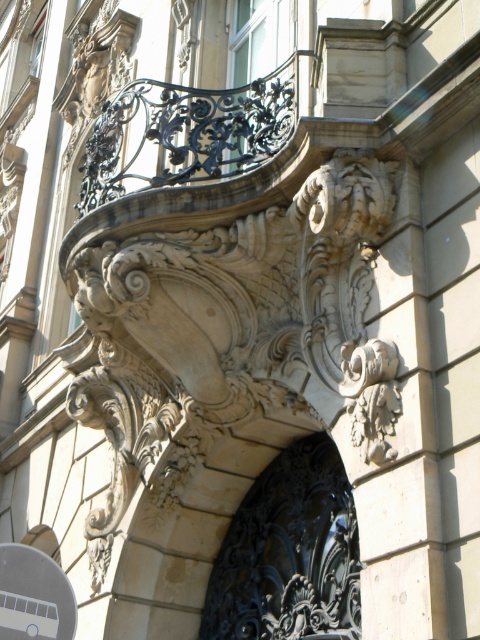
Question: Does white plastic bus at lower left appear on the left side of white stone carving at center?

Choices:
 (A) no
 (B) yes

Answer: (B)

Question: Is black wrought iron door at center closer to the viewer compared to white plastic bus at lower left?

Choices:
 (A) no
 (B) yes

Answer: (A)

Question: Can you confirm if black wrought iron door at center is positioned to the right of white stone carving at center?

Choices:
 (A) no
 (B) yes

Answer: (B)

Question: Which point appears farthest from the camera in this image?

Choices:
 (A) (47, 576)
 (B) (264, 520)

Answer: (B)

Question: Which point is closer to the camera?

Choices:
 (A) (222, 637)
 (B) (7, 561)

Answer: (B)

Question: Which point appears closest to the camera in this image?

Choices:
 (A) (332, 618)
 (B) (14, 568)

Answer: (B)